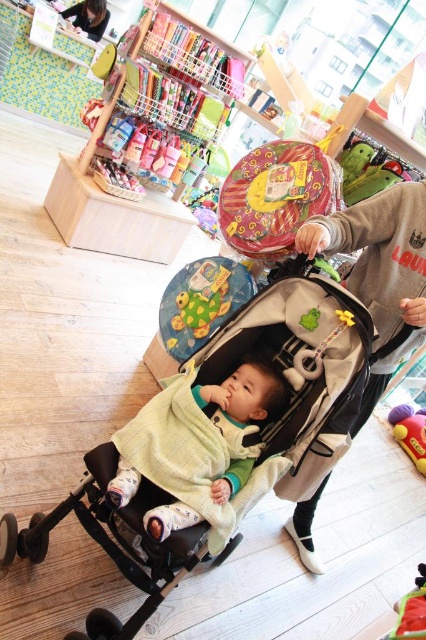
Question: Is soft green blanket at center positioned in front of rubber duck at lower right?

Choices:
 (A) yes
 (B) no

Answer: (B)

Question: Which of the following is the farthest from the observer?

Choices:
 (A) (271, 396)
 (B) (281, 356)
 (C) (411, 440)

Answer: (C)

Question: Can you confirm if soft green blanket at center is positioned above rubber duck at lower right?

Choices:
 (A) no
 (B) yes

Answer: (B)

Question: Which object is the farthest from the matte green rubber turtle at center?

Choices:
 (A) rubberized yellow toy at center
 (B) rubber duck at lower right
 (C) black fabric baby carriage at center

Answer: (A)

Question: Is soft green blanket at center below matte black hair at upper left?

Choices:
 (A) no
 (B) yes

Answer: (B)

Question: Which point appears closest to the camera in this image?

Choices:
 (A) (155, 435)
 (B) (420, 454)

Answer: (A)